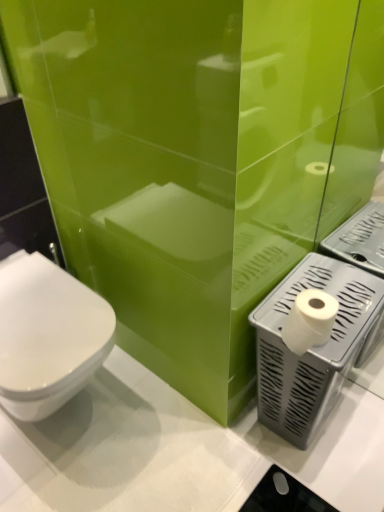
Question: Considering the relative sizes of white matte toilet paper at right and gray plastic toilet paper holder at lower right in the image provided, is white matte toilet paper at right bigger than gray plastic toilet paper holder at lower right?

Choices:
 (A) yes
 (B) no

Answer: (B)

Question: Does white matte toilet paper at right appear on the right side of gray plastic toilet paper holder at lower right?

Choices:
 (A) yes
 (B) no

Answer: (B)

Question: Does white matte toilet paper at right have a greater width compared to gray plastic toilet paper holder at lower right?

Choices:
 (A) no
 (B) yes

Answer: (A)

Question: Does white matte toilet paper at right appear on the left side of gray plastic toilet paper holder at lower right?

Choices:
 (A) yes
 (B) no

Answer: (A)

Question: From the image's perspective, does white matte toilet paper at right appear higher than gray plastic toilet paper holder at lower right?

Choices:
 (A) no
 (B) yes

Answer: (B)

Question: Is white matte toilet paper at right closer to the viewer compared to gray plastic toilet paper holder at lower right?

Choices:
 (A) no
 (B) yes

Answer: (B)

Question: Is white glossy toilet at left taller than gray plastic toilet paper holder at lower right?

Choices:
 (A) no
 (B) yes

Answer: (A)

Question: Is white glossy toilet at left not near gray plastic toilet paper holder at lower right?

Choices:
 (A) no
 (B) yes

Answer: (A)

Question: From the image's perspective, is white glossy toilet at left on top of gray plastic toilet paper holder at lower right?

Choices:
 (A) yes
 (B) no

Answer: (A)

Question: Can you confirm if white glossy toilet at left is smaller than gray plastic toilet paper holder at lower right?

Choices:
 (A) yes
 (B) no

Answer: (B)

Question: From the image's perspective, is white glossy toilet at left located beneath gray plastic toilet paper holder at lower right?

Choices:
 (A) yes
 (B) no

Answer: (B)

Question: Is gray plastic toilet paper holder at lower right located within white glossy toilet at left?

Choices:
 (A) yes
 (B) no

Answer: (B)

Question: Is gray plastic toilet paper holder at lower right turned away from white glossy toilet at left?

Choices:
 (A) yes
 (B) no

Answer: (B)